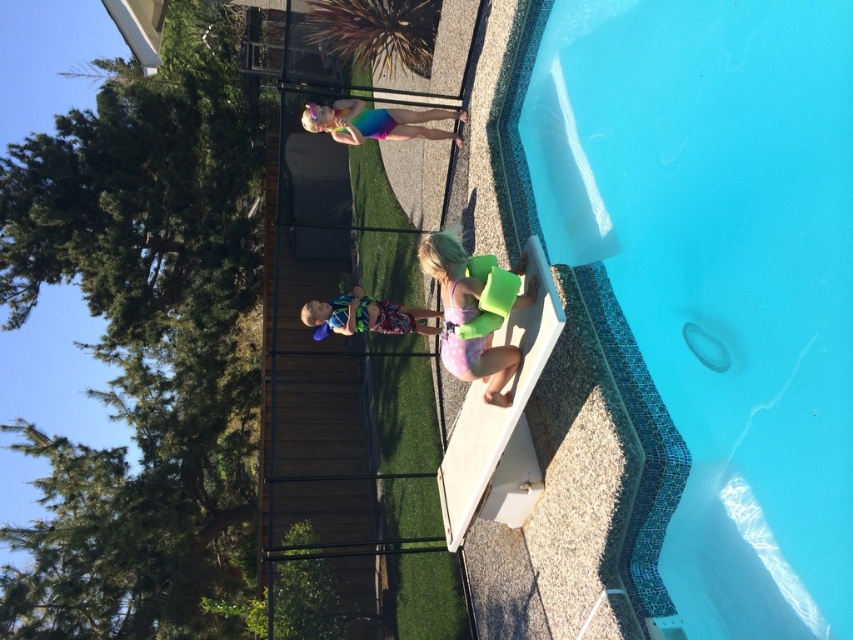
Is blue mosaic tile at upper right above blue printed shorts at center?

Yes, blue mosaic tile at upper right is above blue printed shorts at center.

Measure the distance between blue mosaic tile at upper right and camera.

A distance of 10.47 feet exists between blue mosaic tile at upper right and camera.

Who is more distant from viewer, (759, 308) or (374, 320)?

The point (374, 320) is behind.

At what (x,y) coordinates should I click in order to perform the action: click on blue mosaic tile at upper right. Please return your answer as a coordinate pair (x, y). This screenshot has width=853, height=640. Looking at the image, I should click on (709, 282).

Does rainbow swimsuit at upper center have a larger size compared to blue printed shorts at center?

Yes.

Does rainbow swimsuit at upper center appear over blue printed shorts at center?

Yes, rainbow swimsuit at upper center is above blue printed shorts at center.

Is point (372, 113) closer to camera compared to point (338, 332)?

That is True.

At what (x,y) coordinates should I click in order to perform the action: click on rainbow swimsuit at upper center. Please return your answer as a coordinate pair (x, y). This screenshot has width=853, height=640. Looking at the image, I should click on (376, 122).

From the picture: Does green foam float at lower center have a larger size compared to rainbow swimsuit at upper center?

No.

Does green foam float at lower center have a lesser width compared to rainbow swimsuit at upper center?

Indeed, green foam float at lower center has a lesser width compared to rainbow swimsuit at upper center.

Between point (498, 364) and point (345, 120), which one is positioned in front?

Point (498, 364) is in front.

This screenshot has height=640, width=853. Identify the location of green foam float at lower center. (465, 320).